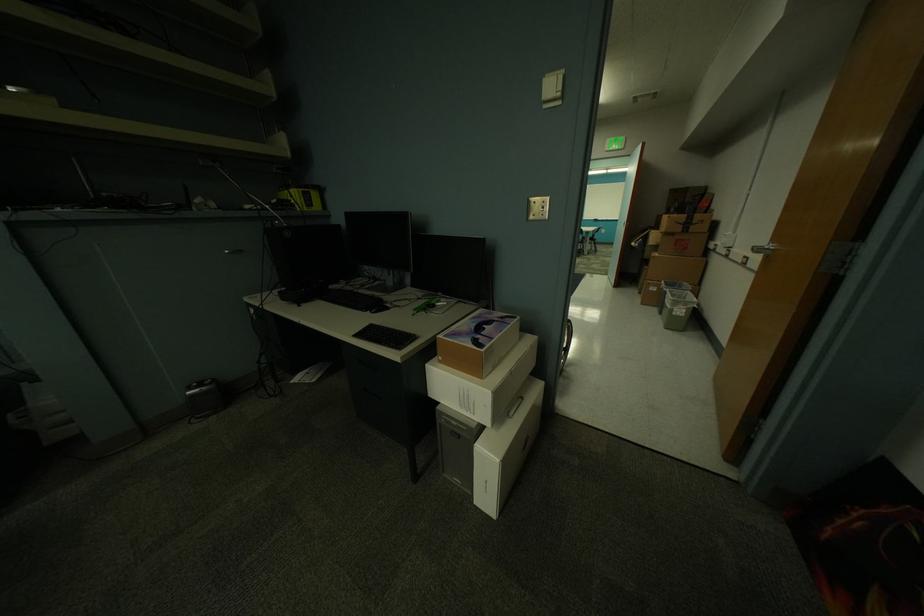
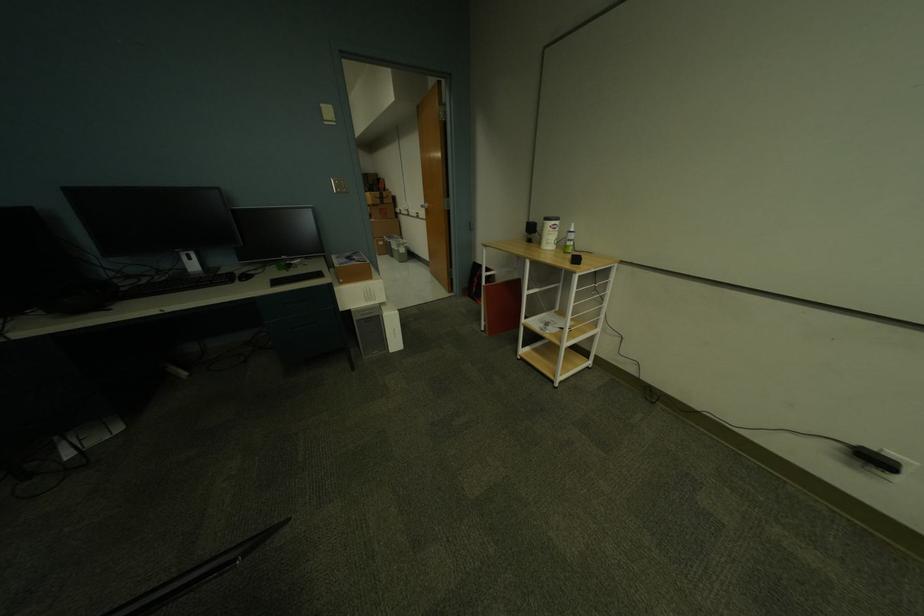
Find the pixel in the second image that matches (x=694, y=217) in the first image.

(386, 195)